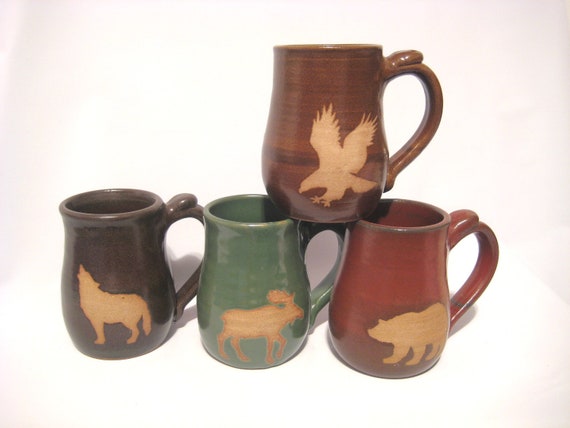
Locate an element on the screen. Image resolution: width=570 pixels, height=428 pixels. brown mug is located at coordinates (105, 248).